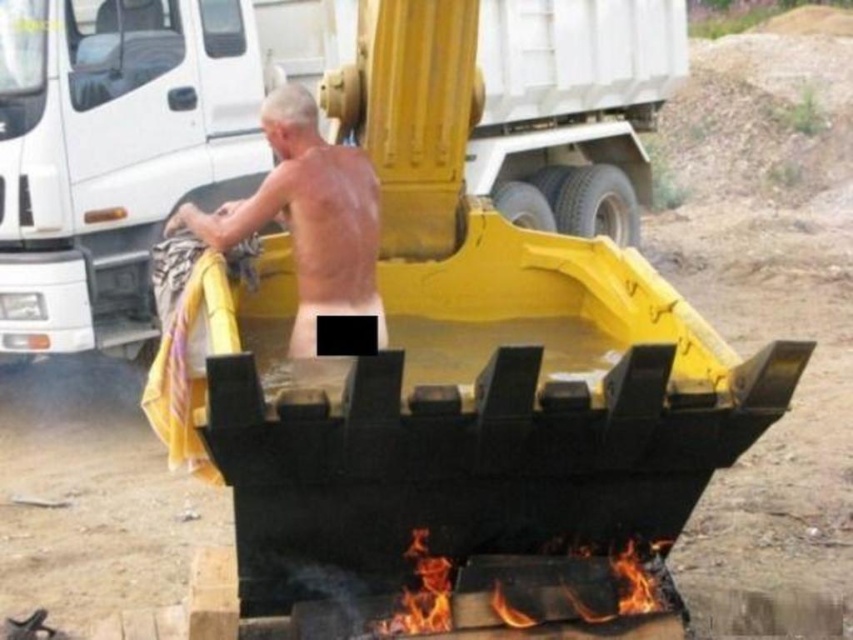
Can you confirm if metallic yellow excavator bucket at center is positioned below flaming wood at lower center?

Actually, metallic yellow excavator bucket at center is above flaming wood at lower center.

Is point (166, 195) in front of point (625, 595)?

No, (166, 195) is behind (625, 595).

What are the coordinates of `metallic yellow excavator bucket at center` in the screenshot? It's located at (131, 145).

The width and height of the screenshot is (853, 640). What are the coordinates of `metallic yellow excavator bucket at center` in the screenshot? It's located at (131, 145).

In the scene shown: Can you confirm if metallic yellow excavator bucket at center is taller than shiny metallic man at center?

No.

Find the location of `metallic yellow excavator bucket at center`. metallic yellow excavator bucket at center is located at coordinates click(x=131, y=145).

From the picture: Which is more to the left, shiny metallic man at center or flaming wood at lower center?

shiny metallic man at center is more to the left.

Is shiny metallic man at center taller than flaming wood at lower center?

Indeed, shiny metallic man at center has a greater height compared to flaming wood at lower center.

Is point (364, 289) less distant than point (384, 620)?

No.

Locate an element on the screen. This screenshot has height=640, width=853. shiny metallic man at center is located at coordinates point(306,218).